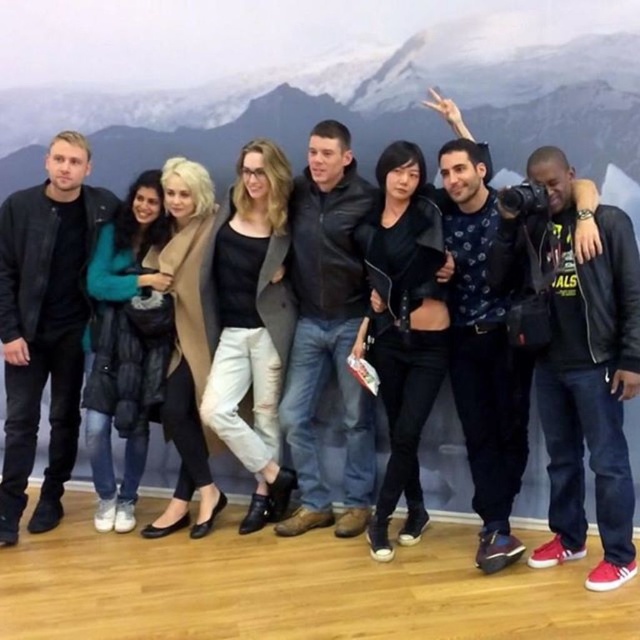
In the scene shown: You are standing in the group photo setup and want to place a small decoration between the two points labeled point (566, 467) and point (326, 172). Which point is closer to you where you should start placing the decoration?

Point (566, 467) is closer to the viewer than point (326, 172), so you should start placing the decoration near point (566, 467) first.

Looking at this image, you are a photographer trying to capture the snowy mountain at upper center and the black leather jacket at left in the same frame. Based on their sizes in the image, which object would appear more dominant visually?

The snowy mountain at upper center would appear more dominant visually because it has a larger size compared to the black leather jacket at left.